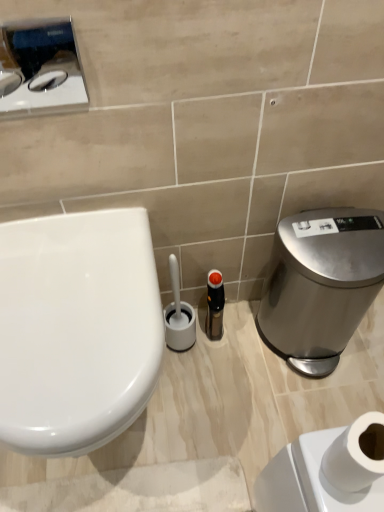
Where is `white matte toilet paper at lower right`? white matte toilet paper at lower right is located at coordinates (356, 454).

In order to click on satin silver trash can at right in this screenshot , I will do `click(321, 285)`.

At what (x,y) coordinates should I click in order to perform the action: click on black plastic bottle at center. Please return your answer as a coordinate pair (x, y). Looking at the image, I should click on (215, 305).

Is black plastic bottle at center in contact with satin silver trash can at right?

black plastic bottle at center and satin silver trash can at right are not in contact.

How different are the orientations of black plastic bottle at center and satin silver trash can at right in degrees?

They differ by 7.74 degrees in their facing directions.

Considering the sizes of black plastic bottle at center and satin silver trash can at right in the image, is black plastic bottle at center taller or shorter than satin silver trash can at right?

black plastic bottle at center is shorter than satin silver trash can at right.

Does black plastic bottle at center have a larger size compared to satin silver trash can at right?

Incorrect, black plastic bottle at center is not larger than satin silver trash can at right.

Is the depth of white matte toilet paper at lower right less than that of black plastic bottle at center?

Yes, it is.

Who is taller, white matte toilet paper at lower right or black plastic bottle at center?

black plastic bottle at center.

Considering the sizes of white matte toilet paper at lower right and black plastic bottle at center in the image, is white matte toilet paper at lower right bigger or smaller than black plastic bottle at center?

In the image, white matte toilet paper at lower right appears to be smaller than black plastic bottle at center.

Where is `appliance above the white glossy toilet at left (from a real-world perspective)`? The width and height of the screenshot is (384, 512). appliance above the white glossy toilet at left (from a real-world perspective) is located at coordinates pos(40,69).

Who is smaller, brushed metal toilet paper dispenser at upper left or white glossy toilet at left?

brushed metal toilet paper dispenser at upper left is smaller.

Looking at this image, which object is positioned more to the right, brushed metal toilet paper dispenser at upper left or white glossy toilet at left?

white glossy toilet at left is more to the right.

Is brushed metal toilet paper dispenser at upper left located outside white glossy toilet at left?

brushed metal toilet paper dispenser at upper left lies outside white glossy toilet at left's area.

Is satin silver trash can at right closer to camera compared to white matte toilet paper at lower right?

That is False.

Which point is more distant from viewer, (365, 246) or (343, 442)?

Point (365, 246)

Is satin silver trash can at right shorter than white matte toilet paper at lower right?

No.

Is satin silver trash can at right aimed at white matte toilet paper at lower right?

No, satin silver trash can at right is not turned towards white matte toilet paper at lower right.

From the image's perspective, which is above, satin silver trash can at right or brushed metal toilet paper dispenser at upper left?

brushed metal toilet paper dispenser at upper left is shown above in the image.

Which of these two, satin silver trash can at right or brushed metal toilet paper dispenser at upper left, stands taller?

satin silver trash can at right is taller.

Is the position of satin silver trash can at right more distant than that of brushed metal toilet paper dispenser at upper left?

Yes, the depth of satin silver trash can at right is greater than that of brushed metal toilet paper dispenser at upper left.

From the picture: Which object is thinner, brushed metal toilet paper dispenser at upper left or black plastic bottle at center?

With smaller width is brushed metal toilet paper dispenser at upper left.

In the image, is brushed metal toilet paper dispenser at upper left positioned in front of or behind black plastic bottle at center?

In the image, brushed metal toilet paper dispenser at upper left appears in front of black plastic bottle at center.

From the picture: From the image's perspective, is brushed metal toilet paper dispenser at upper left under black plastic bottle at center?

No.

Which object is thinner, white glossy toilet at left or black plastic bottle at center?

Thinner between the two is black plastic bottle at center.

In the scene shown: Is white glossy toilet at left positioned with its back to black plastic bottle at center?

No, white glossy toilet at left is not facing away from black plastic bottle at center.

Which of these two, white glossy toilet at left or black plastic bottle at center, stands shorter?

With less height is black plastic bottle at center.

From the picture: From a real-world perspective, between white glossy toilet at left and black plastic bottle at center, who is vertically higher?

From a 3D spatial view, white glossy toilet at left is above.

The height and width of the screenshot is (512, 384). In order to click on toiletry below the satin silver trash can at right (from a real-world perspective) in this screenshot , I will do `click(215, 305)`.

The height and width of the screenshot is (512, 384). Identify the location of toilet paper lying below the black plastic bottle at center (from the image's perspective). (356, 454).

From the image, which object appears to be nearer to brushed metal toilet paper dispenser at upper left, satin silver trash can at right or white glossy toilet at left?

white glossy toilet at left is positioned closer to the anchor brushed metal toilet paper dispenser at upper left.

Based on their spatial positions, is brushed metal toilet paper dispenser at upper left or satin silver trash can at right closer to white matte toilet paper at lower right?

Among the two, satin silver trash can at right is located nearer to white matte toilet paper at lower right.

Which object lies further to the anchor point brushed metal toilet paper dispenser at upper left, white matte toilet paper at lower right or satin silver trash can at right?

Based on the image, white matte toilet paper at lower right appears to be further to brushed metal toilet paper dispenser at upper left.

In the scene shown: Which object lies further to the anchor point white glossy toilet at left, satin silver trash can at right or brushed metal toilet paper dispenser at upper left?

satin silver trash can at right.

Looking at the image, which one is located further to black plastic bottle at center, white matte toilet paper at lower right or satin silver trash can at right?

The object further to black plastic bottle at center is white matte toilet paper at lower right.

From the image, which object appears to be nearer to brushed metal toilet paper dispenser at upper left, white matte toilet paper at lower right or white glossy toilet at left?

white glossy toilet at left is positioned closer to the anchor brushed metal toilet paper dispenser at upper left.

Looking at the image, which one is located closer to satin silver trash can at right, white glossy toilet at left or black plastic bottle at center?

black plastic bottle at center lies closer to satin silver trash can at right than the other object.

When comparing their distances from black plastic bottle at center, does white glossy toilet at left or brushed metal toilet paper dispenser at upper left seem closer?

Based on the image, white glossy toilet at left appears to be nearer to black plastic bottle at center.

Where is `toilet between brushed metal toilet paper dispenser at upper left and satin silver trash can at right`? toilet between brushed metal toilet paper dispenser at upper left and satin silver trash can at right is located at coordinates (77, 329).

Find the location of a particular element. The width and height of the screenshot is (384, 512). toilet positioned between white matte toilet paper at lower right and black plastic bottle at center from near to far is located at coordinates (77, 329).

Locate an element on the screen. The width and height of the screenshot is (384, 512). appliance located between white matte toilet paper at lower right and black plastic bottle at center in the depth direction is located at coordinates (40, 69).

Locate an element on the screen. This screenshot has height=512, width=384. water cooler located between white matte toilet paper at lower right and black plastic bottle at center in the depth direction is located at coordinates (321, 285).